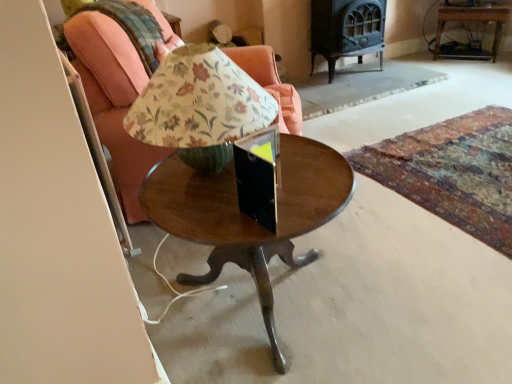
Question: Considering the positions of point (458, 13) and point (142, 4), is point (458, 13) closer or farther from the camera than point (142, 4)?

Choices:
 (A) farther
 (B) closer

Answer: (A)

Question: In terms of height, does wooden side table at upper right look taller or shorter compared to matte wood chair at center?

Choices:
 (A) short
 (B) tall

Answer: (A)

Question: Which object is the farthest from the wooden side table at upper right?

Choices:
 (A) matte wood chair at center
 (B) wooden round table at center

Answer: (B)

Question: Which object is positioned farthest from the wooden round table at center?

Choices:
 (A) matte wood chair at center
 (B) wooden side table at upper right

Answer: (B)